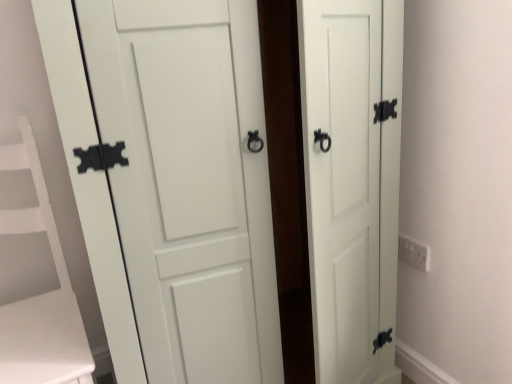
Question: Is white plastic electric outlet at right oriented towards white matte vanity at left?

Choices:
 (A) yes
 (B) no

Answer: (A)

Question: Is white plastic electric outlet at right beside white matte vanity at left?

Choices:
 (A) no
 (B) yes

Answer: (A)

Question: Considering the relative sizes of white plastic electric outlet at right and white matte vanity at left in the image provided, is white plastic electric outlet at right thinner than white matte vanity at left?

Choices:
 (A) no
 (B) yes

Answer: (B)

Question: Can you confirm if white plastic electric outlet at right is taller than white matte vanity at left?

Choices:
 (A) no
 (B) yes

Answer: (A)

Question: Is white plastic electric outlet at right smaller than white matte vanity at left?

Choices:
 (A) no
 (B) yes

Answer: (B)

Question: Is white matte vanity at left a part of white plastic electric outlet at right?

Choices:
 (A) no
 (B) yes

Answer: (A)

Question: Considering the relative sizes of white matte vanity at left and white plastic electric outlet at right in the image provided, is white matte vanity at left thinner than white plastic electric outlet at right?

Choices:
 (A) yes
 (B) no

Answer: (B)

Question: Is white plastic electric outlet at right inside white matte vanity at left?

Choices:
 (A) no
 (B) yes

Answer: (A)

Question: Would you consider white matte vanity at left to be distant from white plastic electric outlet at right?

Choices:
 (A) yes
 (B) no

Answer: (A)

Question: Is white matte vanity at left behind white plastic electric outlet at right?

Choices:
 (A) no
 (B) yes

Answer: (A)

Question: Could you tell me if white matte vanity at left is facing white plastic electric outlet at right?

Choices:
 (A) yes
 (B) no

Answer: (B)

Question: From a real-world perspective, is white matte vanity at left physically above white plastic electric outlet at right?

Choices:
 (A) no
 (B) yes

Answer: (B)

Question: Is white matte door at center to the left of white plastic electric outlet at right from the viewer's perspective?

Choices:
 (A) no
 (B) yes

Answer: (B)